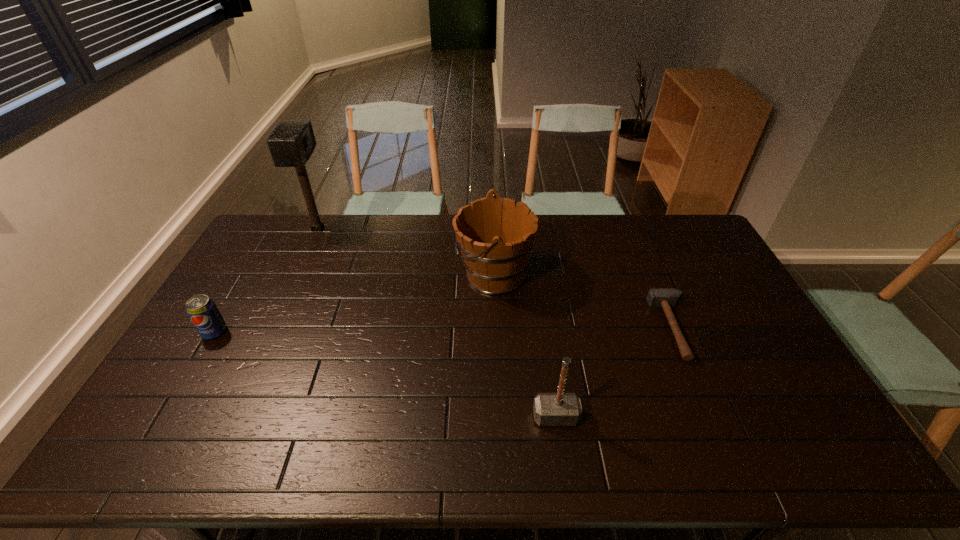
In order to click on free spot between the taller hammer and the farthest object in this screenshot , I will do `click(437, 323)`.

Where is `unoccupied area between the nearer hammer and the second shortest object`? The image size is (960, 540). unoccupied area between the nearer hammer and the second shortest object is located at coordinates (385, 374).

What are the coordinates of `free space between the fourth tallest object and the shortest object` in the screenshot? It's located at (444, 330).

Where is `free space between the taller hammer and the farthest object`? free space between the taller hammer and the farthest object is located at coordinates (437, 323).

The image size is (960, 540). In order to click on object that is the second nearest to the mallet in this screenshot , I will do `click(495, 235)`.

Point out which object is positioned as the fourth nearest to the mallet. Please provide its 2D coordinates. Your answer should be formatted as a tuple, i.e. [(x, y)], where the tuple contains the x and y coordinates of a point satisfying the conditions above.

[(666, 298)]

Image resolution: width=960 pixels, height=540 pixels. Find the location of `free space that satisfies the following two spatial constraints: 1. on the striking surface of the right hammer; 2. on the striking surface of the nearest object`. free space that satisfies the following two spatial constraints: 1. on the striking surface of the right hammer; 2. on the striking surface of the nearest object is located at coordinates (713, 416).

Where is `vacant region that satisfies the following two spatial constraints: 1. on the back side of the fourth object from right to left; 2. on the left side of the leftmost object`? The height and width of the screenshot is (540, 960). vacant region that satisfies the following two spatial constraints: 1. on the back side of the fourth object from right to left; 2. on the left side of the leftmost object is located at coordinates (275, 229).

Find the location of a particular element. This screenshot has height=540, width=960. vacant region that satisfies the following two spatial constraints: 1. on the striking surface of the farther hammer; 2. on the front side of the leftmost object is located at coordinates tap(676, 332).